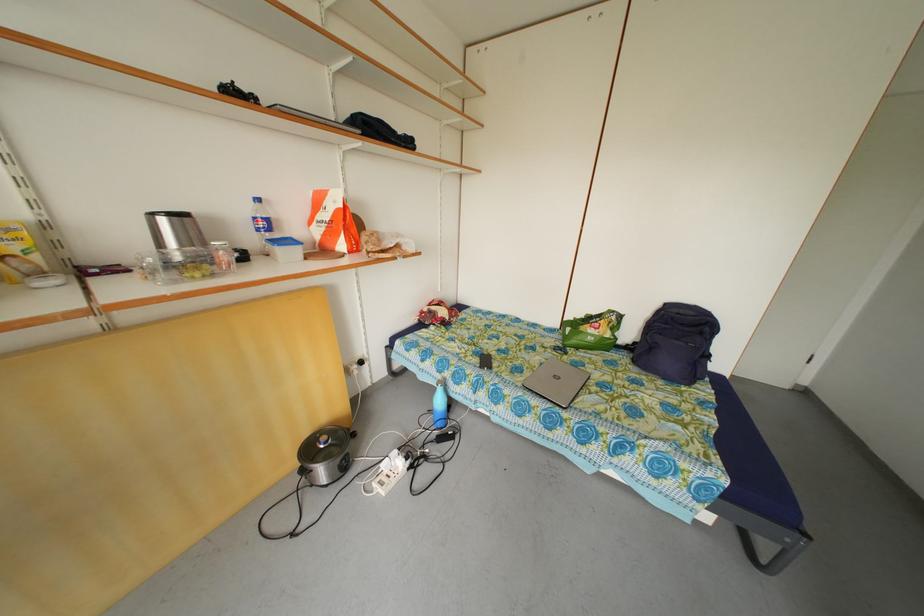
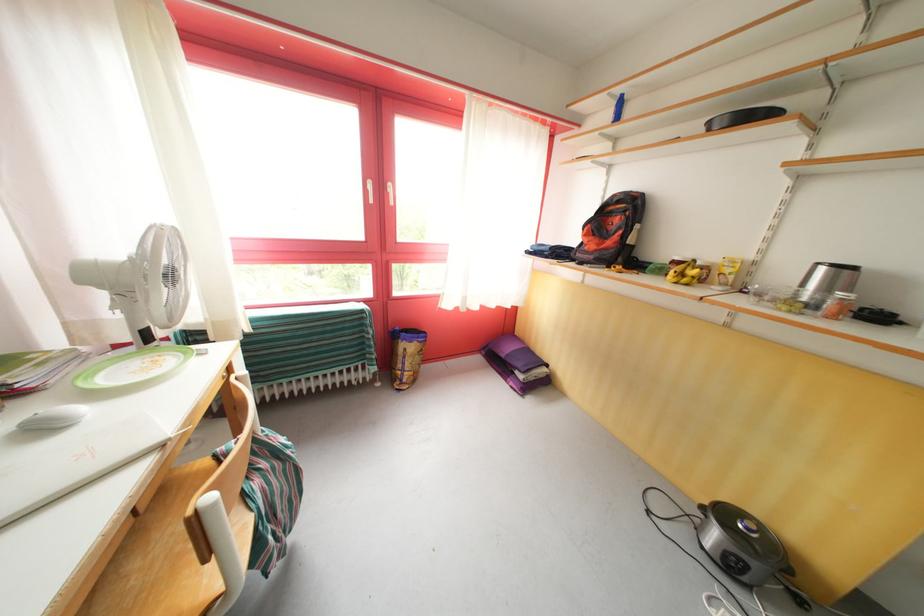
The point at (333,448) is marked in the first image. Where is the corresponding point in the second image?

(755, 535)